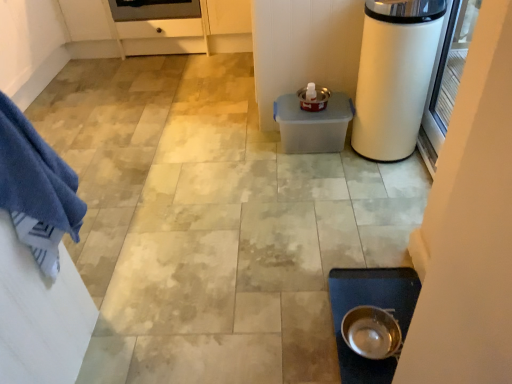
What is the approximate height of blue cotton towel at left?

It is 51.31 centimeters.

This screenshot has height=384, width=512. Describe the element at coordinates (372, 332) in the screenshot. I see `metallic silver bowl at lower center` at that location.

Where is `white glossy trash can at right`? white glossy trash can at right is located at coordinates (394, 75).

Identify the location of blue cotton towel at left. (36, 189).

Is transparent glass screen door at right oriented away from white glossy trash can at right?

Yes.

Considering the relative sizes of transparent glass screen door at right and white glossy trash can at right in the image provided, is transparent glass screen door at right smaller than white glossy trash can at right?

Yes.

Does transparent glass screen door at right have a lesser height compared to white glossy trash can at right?

Yes, transparent glass screen door at right is shorter than white glossy trash can at right.

From a real-world perspective, is transparent glass screen door at right physically below metallic silver bowl at lower center?

No, from a real-world perspective, transparent glass screen door at right is not below metallic silver bowl at lower center.

Where is `screen door on the right of metallic silver bowl at lower center`? This screenshot has height=384, width=512. screen door on the right of metallic silver bowl at lower center is located at coordinates (446, 77).

Looking at this image, from the image's perspective, which one is positioned higher, transparent glass screen door at right or metallic silver bowl at lower center?

transparent glass screen door at right appears higher in the image.

Is metallic silver bowl at lower center a part of transparent glass screen door at right?

No.

Is blue cotton towel at left closer to the viewer compared to white glossy trash can at right?

Yes, blue cotton towel at left is in front of white glossy trash can at right.

Is blue cotton towel at left wider or thinner than white glossy trash can at right?

In the image, blue cotton towel at left appears to be more narrow than white glossy trash can at right.

Image resolution: width=512 pixels, height=384 pixels. Identify the location of appliance below the blue cotton towel at left (from a real-world perspective). (394, 75).

Who is shorter, blue cotton towel at left or white glossy trash can at right?

Standing shorter between the two is blue cotton towel at left.

Is metallic silver bowl at lower center with blue cotton towel at left?

There is a gap between metallic silver bowl at lower center and blue cotton towel at left.

Consider the image. Considering the sizes of objects metallic silver bowl at lower center and blue cotton towel at left in the image provided, who is wider, metallic silver bowl at lower center or blue cotton towel at left?

blue cotton towel at left is wider.

Is metallic silver bowl at lower center at the right side of blue cotton towel at left?

Yes.

How distant is metallic silver bowl at lower center from blue cotton towel at left?

metallic silver bowl at lower center and blue cotton towel at left are 36.41 inches apart from each other.

In the image, there is a white glossy trash can at right. In order to click on kitchen appliance below it (from a real-world perspective) in this screenshot , I will do `click(372, 332)`.

From the image's perspective, is white glossy trash can at right on metallic silver bowl at lower center?

Correct, white glossy trash can at right appears higher than metallic silver bowl at lower center in the image.

Can you confirm if white glossy trash can at right is smaller than metallic silver bowl at lower center?

No.

Is white glossy trash can at right located outside metallic silver bowl at lower center?

Absolutely, white glossy trash can at right is external to metallic silver bowl at lower center.

Is blue cotton towel at left to the left of transparent glass screen door at right from the viewer's perspective?

Correct, you'll find blue cotton towel at left to the left of transparent glass screen door at right.

Looking at the image, does blue cotton towel at left seem bigger or smaller compared to transparent glass screen door at right?

blue cotton towel at left is bigger than transparent glass screen door at right.

Which object is more forward, blue cotton towel at left or transparent glass screen door at right?

blue cotton towel at left is more forward.

Is blue cotton towel at left facing away from transparent glass screen door at right?

No, blue cotton towel at left is not facing away from transparent glass screen door at right.

Can you tell me how much blue cotton towel at left and metallic silver bowl at lower center differ in facing direction?

0.437 degrees.

Is blue cotton towel at left situated inside metallic silver bowl at lower center or outside?

The correct answer is: outside.

Considering the relative sizes of blue cotton towel at left and metallic silver bowl at lower center in the image provided, is blue cotton towel at left thinner than metallic silver bowl at lower center?

Incorrect, the width of blue cotton towel at left is not less than that of metallic silver bowl at lower center.

From the image's perspective, is blue cotton towel at left located beneath metallic silver bowl at lower center?

Actually, blue cotton towel at left appears above metallic silver bowl at lower center in the image.

Identify the location of screen door lying below the white glossy trash can at right (from the image's perspective). 446,77.

Locate an element on the screen. Image resolution: width=512 pixels, height=384 pixels. screen door that is above the metallic silver bowl at lower center (from the image's perspective) is located at coordinates (446, 77).

Based on their spatial positions, is transparent glass screen door at right or blue cotton towel at left further from metallic silver bowl at lower center?

transparent glass screen door at right is further to metallic silver bowl at lower center.

Estimate the real-world distances between objects in this image. Which object is further from transparent glass screen door at right, white glossy trash can at right or blue cotton towel at left?

The object further to transparent glass screen door at right is blue cotton towel at left.

Which object lies further to the anchor point white glossy trash can at right, metallic silver bowl at lower center or blue cotton towel at left?

blue cotton towel at left is further to white glossy trash can at right.

Looking at the image, which one is located further to blue cotton towel at left, metallic silver bowl at lower center or white glossy trash can at right?

white glossy trash can at right lies further to blue cotton towel at left than the other object.

Looking at the image, which one is located further to white glossy trash can at right, transparent glass screen door at right or blue cotton towel at left?

blue cotton towel at left is positioned further to the anchor white glossy trash can at right.

Consider the image. Looking at the image, which one is located further to transparent glass screen door at right, blue cotton towel at left or white glossy trash can at right?

blue cotton towel at left lies further to transparent glass screen door at right than the other object.

Considering their positions, is transparent glass screen door at right positioned further to blue cotton towel at left than metallic silver bowl at lower center?

Among the two, transparent glass screen door at right is located further to blue cotton towel at left.

Which object lies nearer to the anchor point metallic silver bowl at lower center, white glossy trash can at right or blue cotton towel at left?

white glossy trash can at right lies closer to metallic silver bowl at lower center than the other object.

Locate an element on the screen. The image size is (512, 384). appliance between blue cotton towel at left and transparent glass screen door at right is located at coordinates (394, 75).

Identify the location of kitchen appliance between blue cotton towel at left and transparent glass screen door at right in the horizontal direction. (372, 332).

This screenshot has height=384, width=512. I want to click on screen door between white glossy trash can at right and metallic silver bowl at lower center in the vertical direction, so click(446, 77).

Find the location of a particular element. This screenshot has height=384, width=512. kitchen appliance between blue cotton towel at left and white glossy trash can at right is located at coordinates (372, 332).